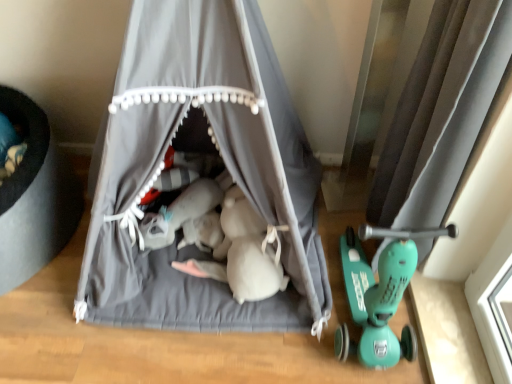
Question: Looking at the image, does silky gray curtain at right, acting as the 2th curtain starting from the left, seem bigger or smaller compared to gray fabric tent at center, which is the first curtain in left-to-right order?

Choices:
 (A) small
 (B) big

Answer: (A)

Question: Would you say silky gray curtain at right, positioned as the first curtain in right-to-left order, is to the left or to the right of gray fabric tent at center, which is the first curtain in left-to-right order, in the picture?

Choices:
 (A) right
 (B) left

Answer: (A)

Question: From a real-world perspective, is silky gray curtain at right, acting as the 2th curtain starting from the left, physically located above or below gray fabric tent at center, which ranks as the 2th curtain in right-to-left order?

Choices:
 (A) below
 (B) above

Answer: (A)

Question: From a real-world perspective, is gray fabric tent at center, which ranks as the 2th curtain in right-to-left order, positioned above or below silky gray curtain at right, acting as the 2th curtain starting from the left?

Choices:
 (A) below
 (B) above

Answer: (B)

Question: In the image, is gray fabric tent at center, which is the first curtain in left-to-right order, on the left side or the right side of silky gray curtain at right, acting as the 2th curtain starting from the left?

Choices:
 (A) left
 (B) right

Answer: (A)

Question: From the image's perspective, is gray fabric tent at center, which ranks as the 2th curtain in right-to-left order, above or below silky gray curtain at right, acting as the 2th curtain starting from the left?

Choices:
 (A) above
 (B) below

Answer: (A)

Question: Looking at their shapes, would you say gray fabric tent at center, which ranks as the 2th curtain in right-to-left order, is wider or thinner than silky gray curtain at right, positioned as the first curtain in right-to-left order?

Choices:
 (A) wide
 (B) thin

Answer: (A)